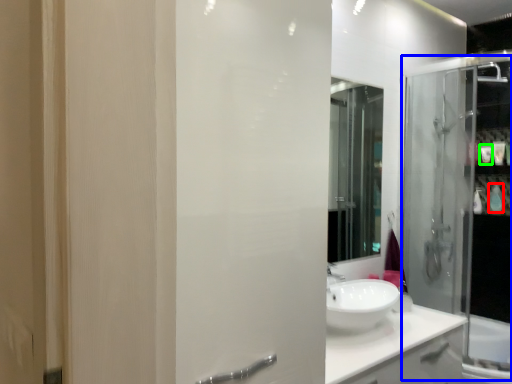
Question: Estimate the real-world distances between objects in this image. Which object is farther from toiletry (highlighted by a red box), shower door (highlighted by a blue box) or toiletry (highlighted by a green box)?

Choices:
 (A) shower door
 (B) toiletry

Answer: (A)